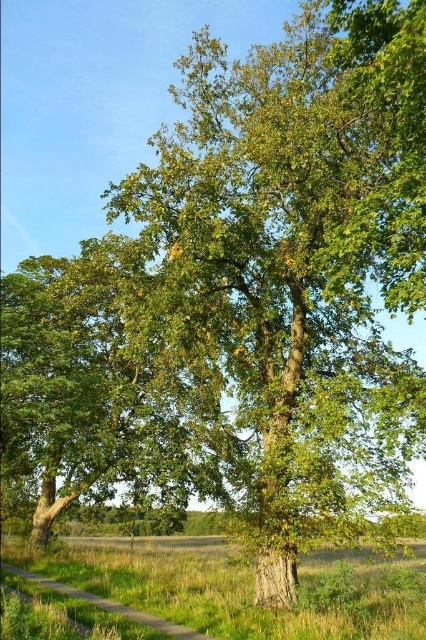
You are standing at the base of the taller tree on the right and want to walk towards the point marked as point (6,563). Will you pass by the point marked as point (132,561) before reaching your destination?

Since point (132,561) is behind point (6,563), you will not pass by point (132,561) before reaching point (6,563).

You are planning to walk from the green grassy path at lower left to the base of the taller tree on the right. Which direction should you head from the green grass at lower left to reach the tree?

Since the green grass at lower left is positioned under the green grassy path at lower left, you should move away from the green grassy path at lower left towards the right to reach the taller tree on the right.